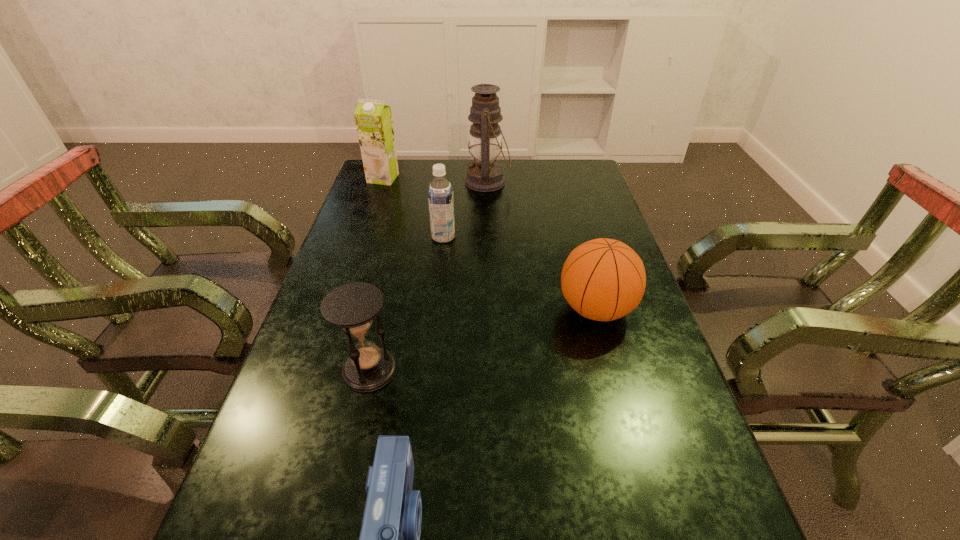
I want to click on unoccupied position between the second nearest object and the basketball, so click(x=483, y=340).

Find the location of `blank region between the left soya milk and the fifth farthest object`. blank region between the left soya milk and the fifth farthest object is located at coordinates (376, 274).

This screenshot has width=960, height=540. I want to click on free space between the hourglass and the tallest object, so click(428, 276).

Where is `object that can be found as the fifth closest to the tallest object`? object that can be found as the fifth closest to the tallest object is located at coordinates coord(389,539).

This screenshot has width=960, height=540. What are the coordinates of `object that is the fifth closest to the left soya milk` in the screenshot? It's located at (389, 539).

At what (x,y) coordinates should I click in order to perform the action: click on blank area in the image that satisfies the following two spatial constraints: 1. on the label of the nearer soya milk; 2. on the left side of the fourth farthest object. Please return your answer as a coordinate pair (x, y). Image resolution: width=960 pixels, height=540 pixels. Looking at the image, I should click on (436, 309).

The height and width of the screenshot is (540, 960). Identify the location of free space in the image that satisfies the following two spatial constraints: 1. on the label of the fourth farthest object; 2. on the right side of the right soya milk. (436, 309).

Identify the location of vacant space that satisfies the following two spatial constraints: 1. on the label of the right soya milk; 2. on the back side of the third nearest object. This screenshot has width=960, height=540. (436, 309).

This screenshot has width=960, height=540. I want to click on vacant area in the image that satisfies the following two spatial constraints: 1. on the label of the shorter soya milk; 2. on the left side of the fourth farthest object, so click(436, 309).

The height and width of the screenshot is (540, 960). In order to click on vacant region that satisfies the following two spatial constraints: 1. on the back side of the hourglass; 2. on the left side of the second object from right to left in this screenshot , I will do `click(413, 182)`.